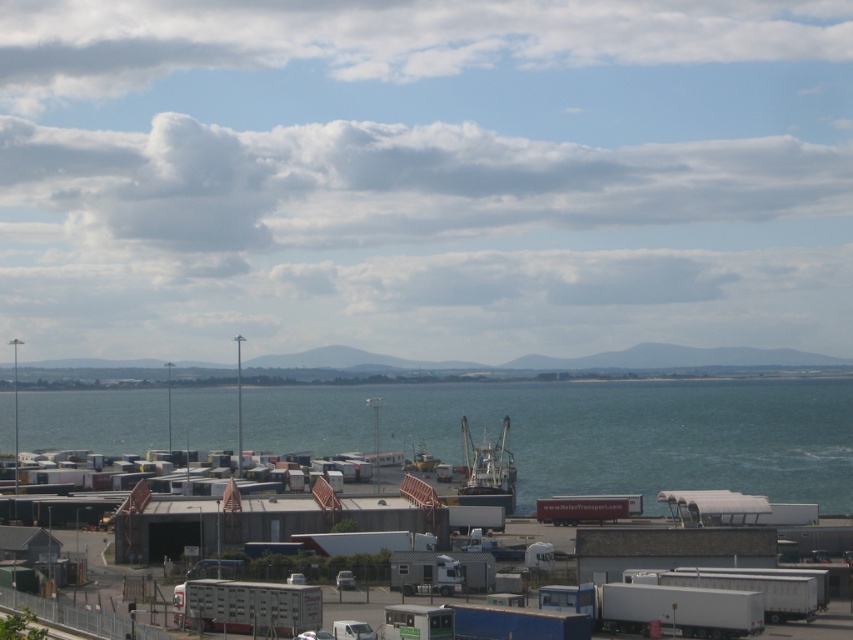
Who is shorter, white metallic trailer truck at lower center or white matte trailer truck at center?

white matte trailer truck at center

Does white metallic trailer truck at lower center have a smaller size compared to white matte trailer truck at center?

Correct, white metallic trailer truck at lower center occupies less space than white matte trailer truck at center.

Who is more distant from viewer, (259, 589) or (538, 508)?

Point (538, 508)

Find the location of a particular element. white metallic trailer truck at lower center is located at coordinates (248, 605).

Can you confirm if metallic gray boat at center is smaller than white matte trailer truck at center?

Incorrect, metallic gray boat at center is not smaller in size than white matte trailer truck at center.

Who is more distant from viewer, (x=486, y=497) or (x=585, y=504)?

The point (x=486, y=497) is behind.

I want to click on metallic gray boat at center, so click(x=488, y=467).

Is point (10, 429) positioned in front of point (235, 588)?

No, (10, 429) is further to viewer.

Who is more forward, (339, 401) or (189, 616)?

Point (189, 616) is in front.

Where is `blue water at lower center`? blue water at lower center is located at coordinates (593, 433).

The image size is (853, 640). Find the location of `blue water at lower center`. blue water at lower center is located at coordinates (593, 433).